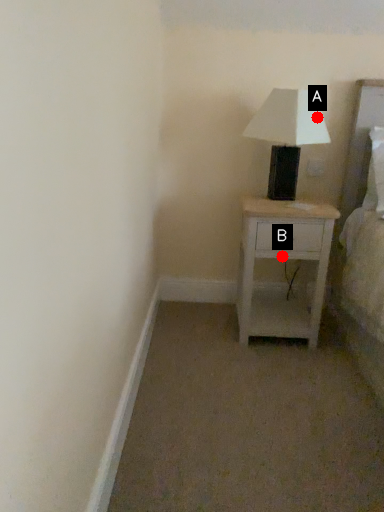
Question: Two points are circled on the image, labeled by A and B beside each circle. Which point is farther from the camera taking this photo?

Choices:
 (A) A is further
 (B) B is further

Answer: (B)